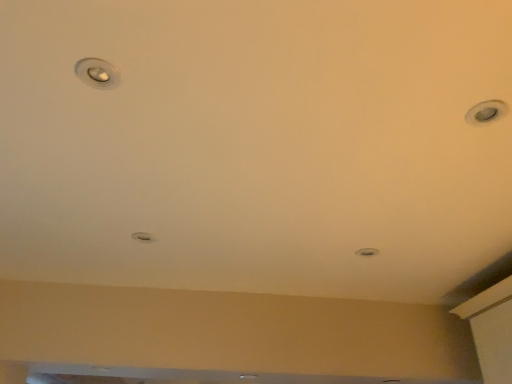
Question: Is matte silver droplight at center, the 1th droplight from the bottom, taller than matte silver light at center?

Choices:
 (A) yes
 (B) no

Answer: (B)

Question: Is matte silver droplight at center, the 1th droplight in the left-to-right sequence, shorter than matte silver light at center?

Choices:
 (A) no
 (B) yes

Answer: (B)

Question: From a real-world perspective, is matte silver droplight at center, the 1th droplight from the bottom, positioned over matte silver light at center based on gravity?

Choices:
 (A) yes
 (B) no

Answer: (B)

Question: From the image's perspective, is matte silver droplight at center, which is the 2th droplight from front to back, above matte silver light at center?

Choices:
 (A) yes
 (B) no

Answer: (A)

Question: Is matte silver droplight at center, acting as the first droplight starting from the back, positioned before matte silver light at center?

Choices:
 (A) yes
 (B) no

Answer: (A)

Question: Considering the positions of matte silver droplight at upper left, which ranks as the 2th droplight in back-to-front order, and matte silver droplight at center, the 1th droplight in the left-to-right sequence, in the image, is matte silver droplight at upper left, which ranks as the 2th droplight in back-to-front order, wider or thinner than matte silver droplight at center, the 1th droplight in the left-to-right sequence,?

Choices:
 (A) thin
 (B) wide

Answer: (A)

Question: From a real-world perspective, is matte silver droplight at upper left, which is the second droplight from bottom to top, positioned above or below matte silver droplight at center, the 2th droplight when ordered from top to bottom?

Choices:
 (A) above
 (B) below

Answer: (A)

Question: Considering the relative positions of matte silver droplight at upper left, the 1th droplight from the right, and matte silver droplight at center, acting as the first droplight starting from the back, in the image provided, is matte silver droplight at upper left, the 1th droplight from the right, to the left or to the right of matte silver droplight at center, acting as the first droplight starting from the back,?

Choices:
 (A) left
 (B) right

Answer: (B)

Question: Is matte silver droplight at upper left, marked as the first droplight in a front-to-back arrangement, in front of or behind matte silver droplight at center, the 1th droplight from the bottom, in the image?

Choices:
 (A) behind
 (B) front

Answer: (B)

Question: Considering the positions of matte silver light at center and matte silver droplight at upper left, which is the second droplight from bottom to top, in the image, is matte silver light at center bigger or smaller than matte silver droplight at upper left, which is the second droplight from bottom to top,?

Choices:
 (A) small
 (B) big

Answer: (B)

Question: Considering their positions, is matte silver light at center located in front of or behind matte silver droplight at upper left, marked as the 1th droplight in a top-to-bottom arrangement?

Choices:
 (A) front
 (B) behind

Answer: (B)

Question: Is point (372, 251) closer or farther from the camera than point (109, 64)?

Choices:
 (A) closer
 (B) farther

Answer: (B)

Question: From the image's perspective, is matte silver light at center above or below matte silver droplight at upper left, which is the second droplight from bottom to top?

Choices:
 (A) below
 (B) above

Answer: (A)

Question: Looking at the image, does matte silver droplight at upper left, which ranks as the 2th droplight in back-to-front order, seem bigger or smaller compared to matte silver light at center?

Choices:
 (A) big
 (B) small

Answer: (B)

Question: Considering their positions, is matte silver droplight at upper left, which ranks as the 2th droplight in back-to-front order, located in front of or behind matte silver light at center?

Choices:
 (A) front
 (B) behind

Answer: (A)